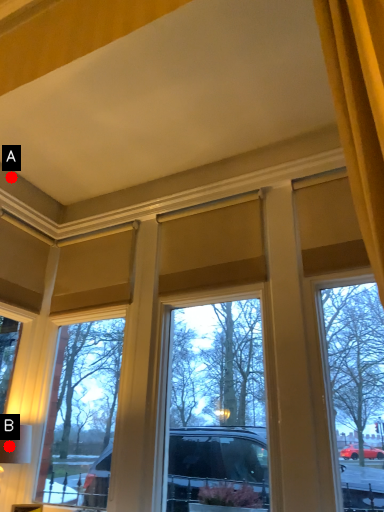
Question: Two points are circled on the image, labeled by A and B beside each circle. Among these points, which one is farthest from the camera?

Choices:
 (A) A is further
 (B) B is further

Answer: (A)